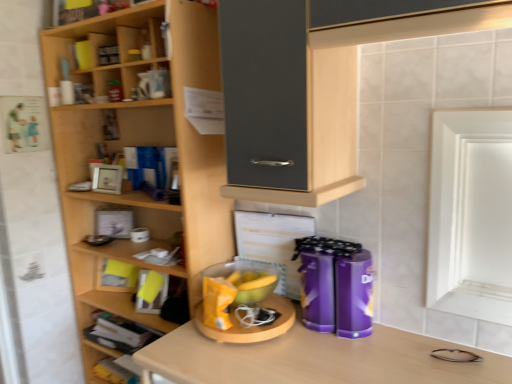
Locate an element on the screen. The image size is (512, 384). vacant area on top of wooden desk at center (from a real-world perspective) is located at coordinates (259, 354).